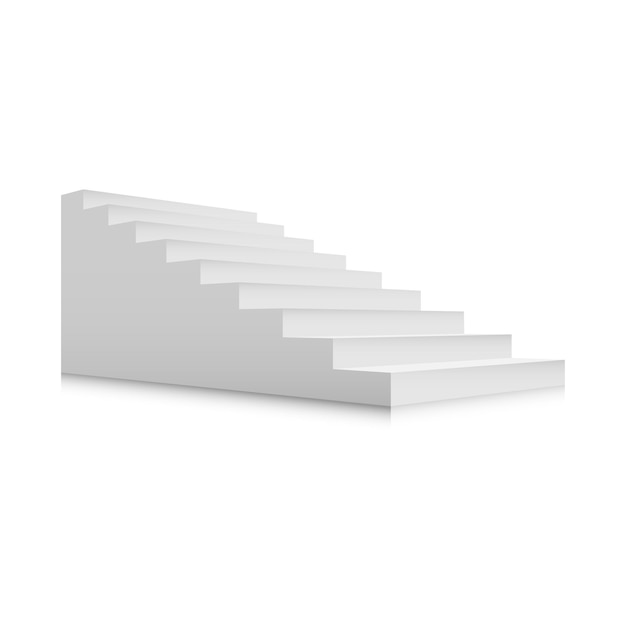
Where is `stair riser`? The image size is (626, 626). stair riser is located at coordinates (407, 386), (356, 354), (304, 329), (260, 299), (217, 275), (182, 254), (153, 235), (116, 215), (93, 198).